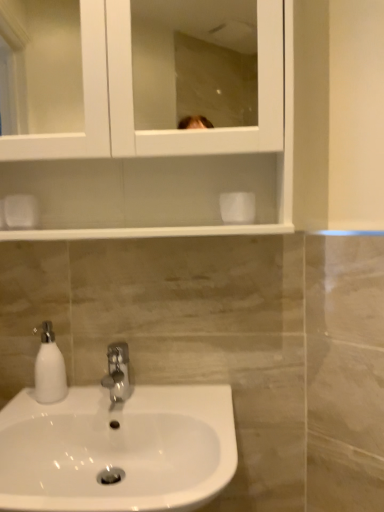
Question: From a real-world perspective, is white glossy sink at lower left above or below white glossy soap dispenser at lower left?

Choices:
 (A) above
 (B) below

Answer: (B)

Question: Considering the positions of white glossy sink at lower left and white glossy soap dispenser at lower left in the image, is white glossy sink at lower left taller or shorter than white glossy soap dispenser at lower left?

Choices:
 (A) tall
 (B) short

Answer: (A)

Question: Considering the real-world distances, which object is farthest from the white glossy sink at lower left?

Choices:
 (A) white glossy medicine cabinet at upper center
 (B) white glossy soap dispenser at lower left
 (C) polished chrome faucet at center

Answer: (A)

Question: Based on their relative distances, which object is nearer to the white glossy medicine cabinet at upper center?

Choices:
 (A) white glossy soap dispenser at lower left
 (B) polished chrome faucet at center
 (C) white glossy sink at lower left

Answer: (A)